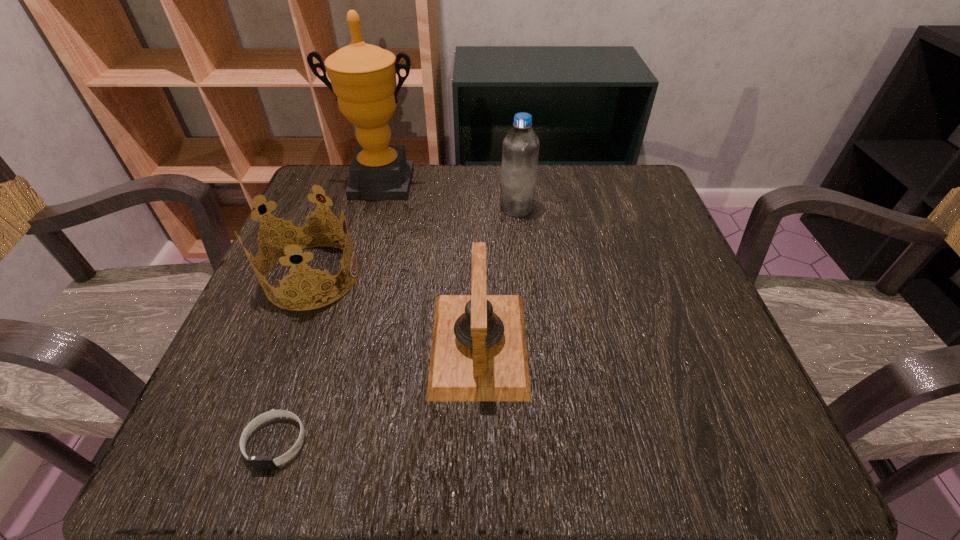
The height and width of the screenshot is (540, 960). Find the location of `vacant space at the right edge of the desktop`. vacant space at the right edge of the desktop is located at coordinates tap(626, 238).

This screenshot has width=960, height=540. In order to click on vacant space at the far left corner of the desktop in this screenshot , I will do `click(312, 184)`.

This screenshot has height=540, width=960. I want to click on free spot at the far right corner of the desktop, so click(606, 207).

This screenshot has width=960, height=540. I want to click on free space between the award and the bell, so click(x=430, y=264).

Image resolution: width=960 pixels, height=540 pixels. Find the location of `vacant space in between the second tallest object and the shortest object`. vacant space in between the second tallest object and the shortest object is located at coordinates (396, 325).

This screenshot has height=540, width=960. Identify the location of unoccupied area between the shortest object and the award. (328, 313).

Identify the location of vacant space that is in between the tallest object and the nearest object. The height and width of the screenshot is (540, 960). (328, 313).

This screenshot has height=540, width=960. I want to click on free point between the tallest object and the water bottle, so click(449, 195).

Where is `free space between the nearest object and the award`? free space between the nearest object and the award is located at coordinates [x=328, y=313].

Find the location of `unoccupied area between the shortest object and the bell`. unoccupied area between the shortest object and the bell is located at coordinates (377, 393).